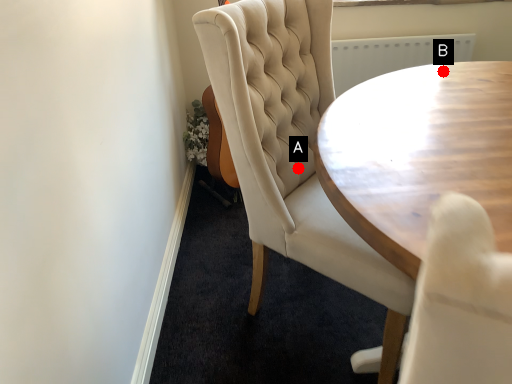
Question: Two points are circled on the image, labeled by A and B beside each circle. Which of the following is the farthest from the observer?

Choices:
 (A) A is further
 (B) B is further

Answer: (B)